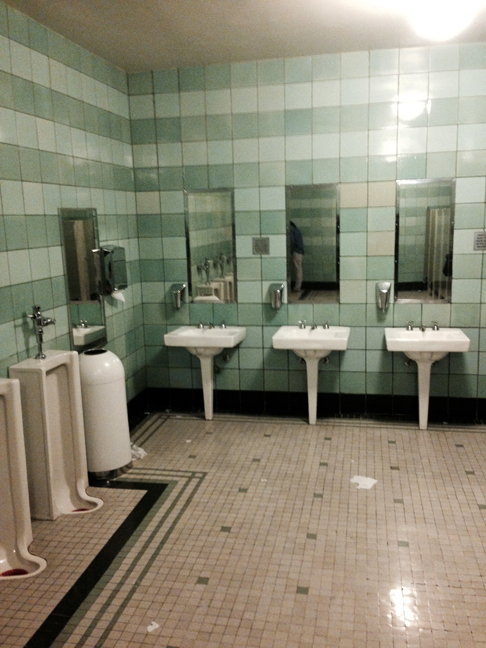
Where is `mirror`? Image resolution: width=486 pixels, height=648 pixels. mirror is located at coordinates (223, 218), (312, 232), (414, 234).